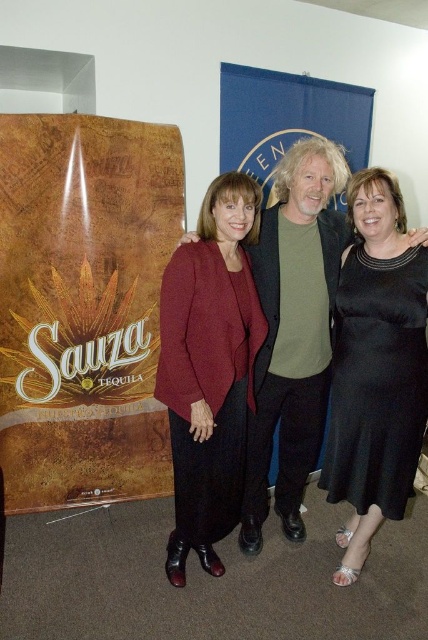
Between black satin dress at center and matte black dress at center, which one has less height?

black satin dress at center is shorter.

Is black satin dress at center further to the viewer compared to matte black dress at center?

No, black satin dress at center is closer to the viewer.

Who is more distant from viewer, (407,355) or (309,369)?

The point (309,369) is more distant.

What are the coordinates of `black satin dress at center` in the screenshot? It's located at (376, 369).

Is brown wood grain poster at left behind matte black dress at center?

Yes.

Where is `brown wood grain poster at left`? Image resolution: width=428 pixels, height=640 pixels. brown wood grain poster at left is located at coordinates coord(83,305).

Between brown wood grain poster at left and maroon woolen cardigan at center, which one has less height?

Standing shorter between the two is maroon woolen cardigan at center.

Is brown wood grain poster at left wider than maroon woolen cardigan at center?

Correct, the width of brown wood grain poster at left exceeds that of maroon woolen cardigan at center.

Locate an element on the screen. This screenshot has width=428, height=640. brown wood grain poster at left is located at coordinates (83, 305).

Identify the location of brown wood grain poster at left. [83, 305].